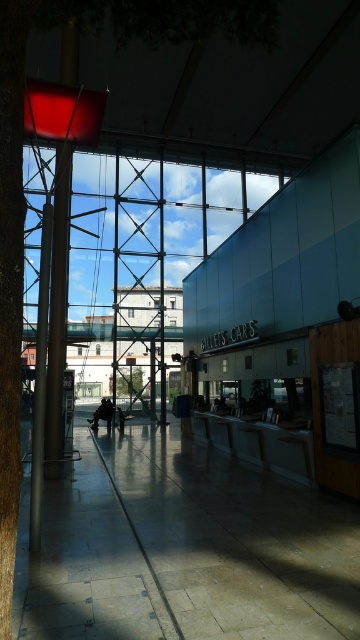
Question: Does green leafy tree at center have a larger size compared to dark gray fabric jacket at center?

Choices:
 (A) no
 (B) yes

Answer: (A)

Question: Is green leafy tree at center below dark gray fabric jacket at center?

Choices:
 (A) no
 (B) yes

Answer: (A)

Question: Which object is positioned closest to the green leafy tree at center?

Choices:
 (A) dark gray fabric jacket at center
 (B) polished concrete floor at center
 (C) polished silver pole at left

Answer: (A)

Question: Which of the following is the farthest from the observer?

Choices:
 (A) (93, 420)
 (B) (119, 392)
 (C) (132, 609)
 (D) (43, 348)

Answer: (B)

Question: Is polished silver pole at left positioned before dark gray fabric jacket at center?

Choices:
 (A) yes
 (B) no

Answer: (A)

Question: Which object is farther from the camera taking this photo?

Choices:
 (A) green leafy tree at center
 (B) polished silver pole at left
 (C) dark gray fabric jacket at center

Answer: (A)